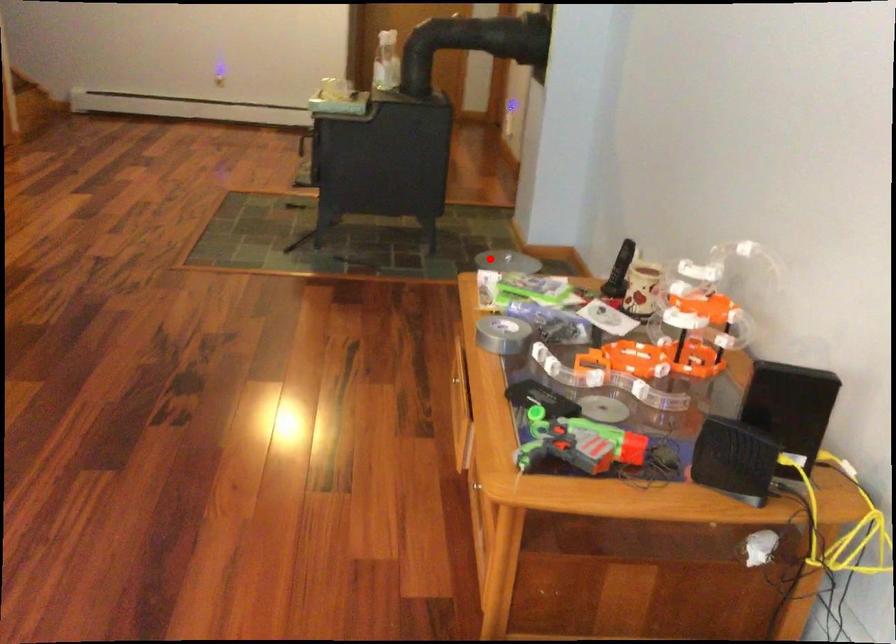
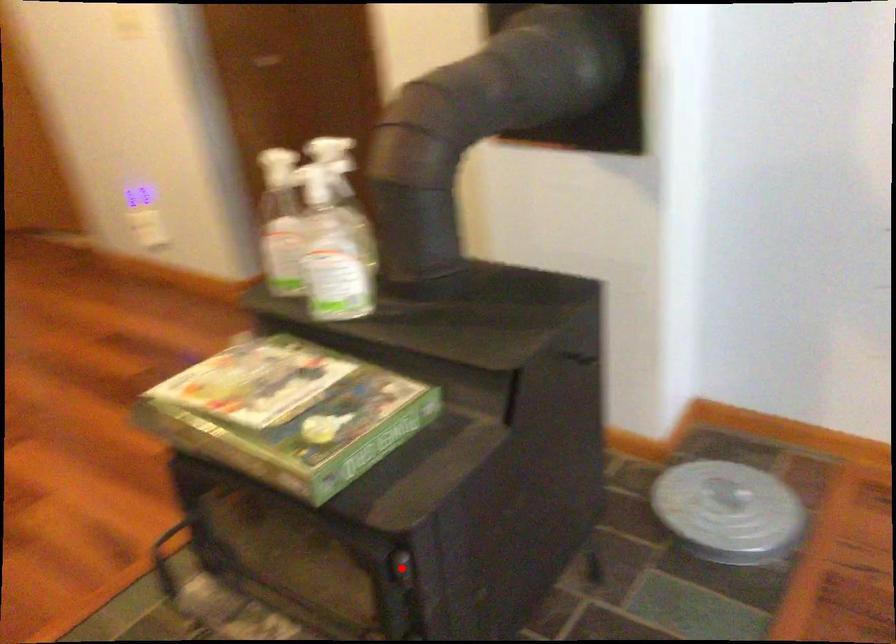
I am providing you with two images of the same scene from different viewpoints. A red point is marked on the first image and another point is marked on the second image. Are the points marked in image1 and image2 representing the same 3D position?

No